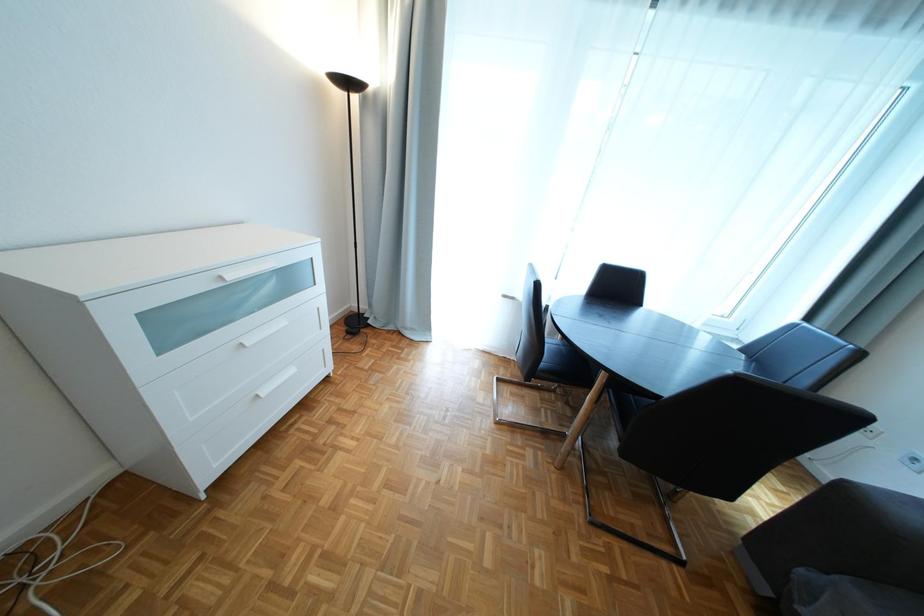
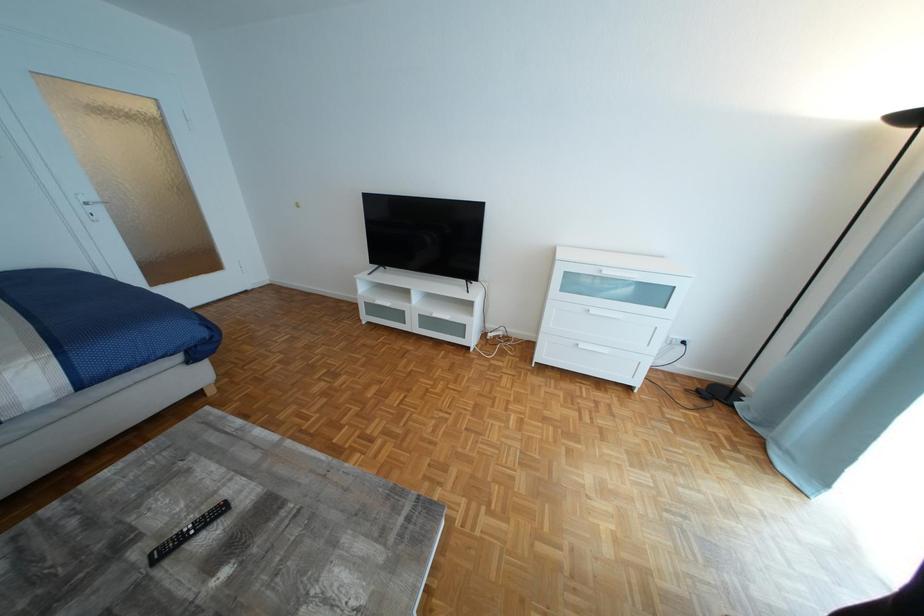
First-person continuous shooting, in which direction is the camera rotating?

The rotation direction of the camera is left-down.